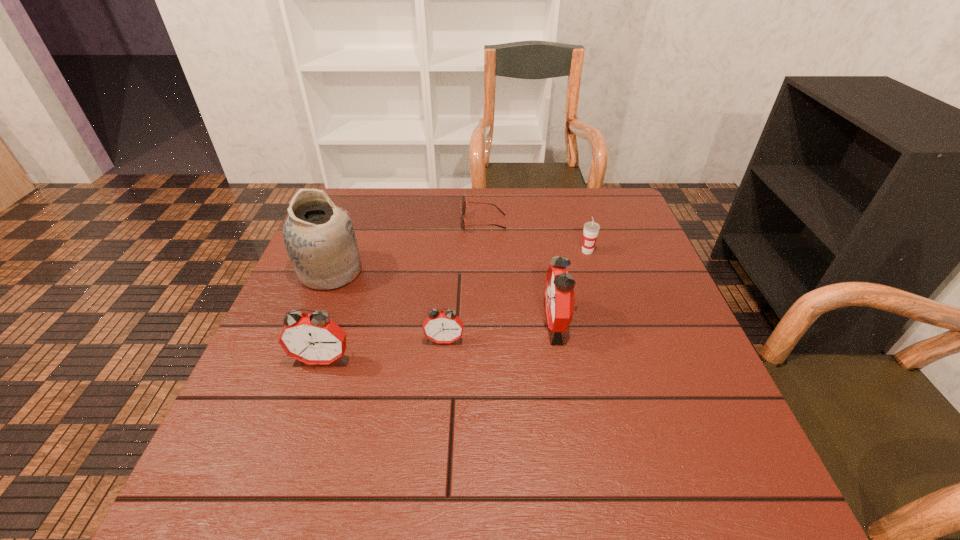
Find the location of a particular element. The height and width of the screenshot is (540, 960). vacant space located on the clock face of the rightmost alarm clock is located at coordinates (391, 323).

Where is `free location located on the clock face of the rightmost alarm clock`? free location located on the clock face of the rightmost alarm clock is located at coordinates (476, 323).

You are a GUI agent. You are given a task and a screenshot of the screen. Output one action in this format:
    pyautogui.click(x=<x>, y=<y>)
    Task: Click on the vacant region located 0.210m on the clock face of the rightmost alarm clock
    
    Given the screenshot: What is the action you would take?
    pyautogui.click(x=449, y=323)

Find the location of `free space located on the front-facing side of the farthest object`. free space located on the front-facing side of the farthest object is located at coordinates (396, 222).

Identify the location of blank area located 0.170m on the front-facing side of the farthest object. The image size is (960, 540). (403, 222).

You are a GUI agent. You are given a task and a screenshot of the screen. Output one action in this format:
    pyautogui.click(x=<x>, y=<y>)
    Task: Click on the free space located on the front-facing side of the farthest object
    Image resolution: width=960 pixels, height=540 pixels.
    Given the screenshot: What is the action you would take?
    pyautogui.click(x=372, y=222)

I want to click on free spot located on the front of the tallest object, so click(296, 360).

Find the location of a particular element. This screenshot has height=540, width=960. vacant region located on the side of the rightmost object with the logo is located at coordinates (596, 281).

Identify the location of object that is at the far edge. The image size is (960, 540). (463, 208).

I want to click on alarm clock positioned at the left edge, so click(314, 338).